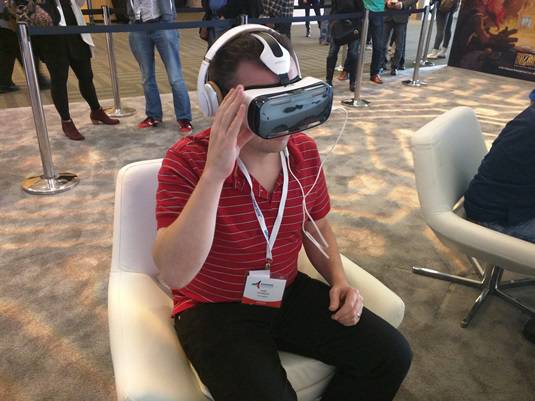
Identify the location of chair. This screenshot has height=401, width=535. (159, 320), (439, 189).